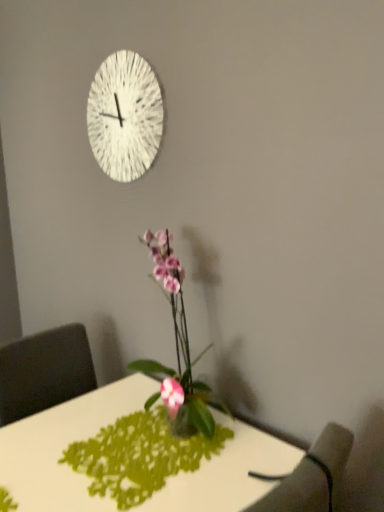
Identify the location of vacant area on top of white glossy desk at center (from a real-world perspective). (98, 441).